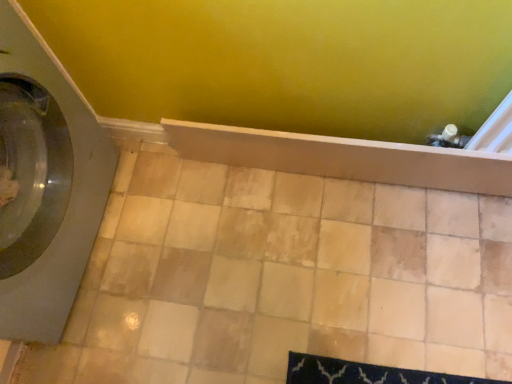
Find the location of a particular element. The width and height of the screenshot is (512, 384). free spot in front of wooden shelf at center is located at coordinates (358, 276).